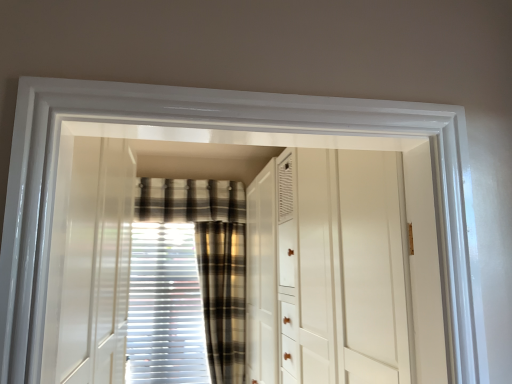
Question: Which direction should I rotate to look at white textured blinds at center, the 2th curtain when ordered from right to left, — up or down?

Choices:
 (A) down
 (B) up

Answer: (A)

Question: Does white textured blinds at center, the 2th curtain when ordered from right to left, have a smaller size compared to plaid fabric curtain at center, the first curtain from the right?

Choices:
 (A) yes
 (B) no

Answer: (A)

Question: Is white textured blinds at center, the 2th curtain when ordered from right to left, oriented towards plaid fabric curtain at center, which is the 2th curtain in left-to-right order?

Choices:
 (A) no
 (B) yes

Answer: (B)

Question: Is white textured blinds at center, the 2th curtain when ordered from right to left, turned away from plaid fabric curtain at center, the first curtain from the right?

Choices:
 (A) no
 (B) yes

Answer: (A)

Question: Does white textured blinds at center, the 2th curtain when ordered from right to left, have a greater width compared to plaid fabric curtain at center, the first curtain from the right?

Choices:
 (A) no
 (B) yes

Answer: (A)

Question: Considering the relative positions of white textured blinds at center, the 2th curtain when ordered from right to left, and plaid fabric curtain at center, which is the 2th curtain in left-to-right order, in the image provided, is white textured blinds at center, the 2th curtain when ordered from right to left, to the left of plaid fabric curtain at center, which is the 2th curtain in left-to-right order, from the viewer's perspective?

Choices:
 (A) yes
 (B) no

Answer: (A)

Question: From a real-world perspective, does white textured blinds at center, acting as the 1th curtain starting from the left, stand above plaid fabric curtain at center, which is the 2th curtain in left-to-right order?

Choices:
 (A) yes
 (B) no

Answer: (B)

Question: Can you see white glossy dresser at center touching plaid fabric curtain at center, which is the 2th curtain in left-to-right order?

Choices:
 (A) no
 (B) yes

Answer: (A)

Question: From the image's perspective, is white glossy dresser at center on plaid fabric curtain at center, which is the 2th curtain in left-to-right order?

Choices:
 (A) no
 (B) yes

Answer: (B)

Question: Does white glossy dresser at center have a larger size compared to plaid fabric curtain at center, which is the 2th curtain in left-to-right order?

Choices:
 (A) no
 (B) yes

Answer: (B)

Question: From a real-world perspective, is white glossy dresser at center physically below plaid fabric curtain at center, which is the 2th curtain in left-to-right order?

Choices:
 (A) no
 (B) yes

Answer: (A)

Question: Is white glossy dresser at center to the left of plaid fabric curtain at center, the first curtain from the right, from the viewer's perspective?

Choices:
 (A) yes
 (B) no

Answer: (B)

Question: Is white glossy dresser at center smaller than plaid fabric curtain at center, the first curtain from the right?

Choices:
 (A) no
 (B) yes

Answer: (A)

Question: Considering the relative sizes of plaid fabric curtain at center, the first curtain from the right, and plaid fabric at center in the image provided, is plaid fabric curtain at center, the first curtain from the right, shorter than plaid fabric at center?

Choices:
 (A) yes
 (B) no

Answer: (B)